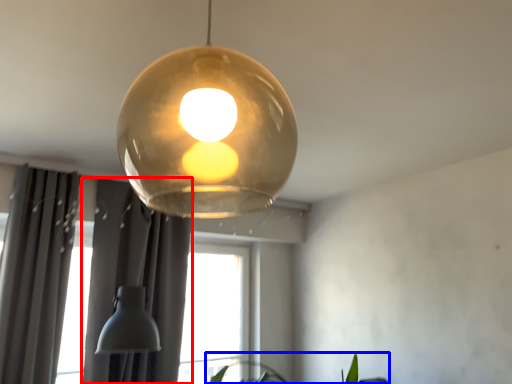
Question: Which point is further to the camera, curtain (highlighted by a red box) or plant (highlighted by a blue box)?

Choices:
 (A) curtain
 (B) plant

Answer: (A)